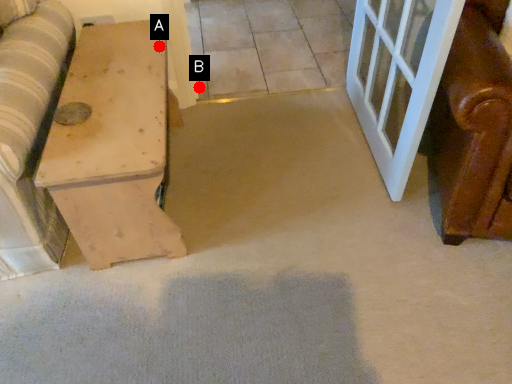
Question: Two points are circled on the image, labeled by A and B beside each circle. Which point is closer to the camera taking this photo?

Choices:
 (A) A is closer
 (B) B is closer

Answer: (A)